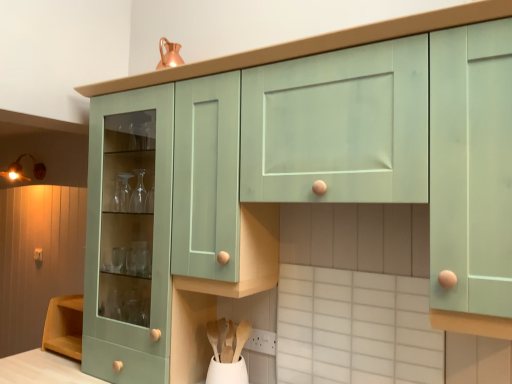
Question: From the image's perspective, is matte wooden knob at lower left over mint green cabinet at center?

Choices:
 (A) no
 (B) yes

Answer: (A)

Question: Can you confirm if matte wooden knob at lower left is thinner than mint green cabinet at center?

Choices:
 (A) yes
 (B) no

Answer: (A)

Question: Is matte wooden knob at lower left completely or partially outside of mint green cabinet at center?

Choices:
 (A) yes
 (B) no

Answer: (A)

Question: Would you say matte wooden knob at lower left contains mint green cabinet at center?

Choices:
 (A) yes
 (B) no

Answer: (B)

Question: Is matte wooden knob at lower left behind mint green cabinet at center?

Choices:
 (A) yes
 (B) no

Answer: (A)

Question: In the image, is white matte vase at lower center positioned in front of or behind wooden at lower center, which is the 1th spoon from right to left?

Choices:
 (A) behind
 (B) front

Answer: (B)

Question: Based on their positions, is white matte vase at lower center located to the left or right of wooden at lower center, positioned as the second spoon in left-to-right order?

Choices:
 (A) right
 (B) left

Answer: (B)

Question: From the image's perspective, is white matte vase at lower center positioned above or below wooden at lower center, positioned as the second spoon in left-to-right order?

Choices:
 (A) above
 (B) below

Answer: (B)

Question: Do you think white matte vase at lower center is within wooden at lower center, positioned as the second spoon in left-to-right order, or outside of it?

Choices:
 (A) outside
 (B) inside

Answer: (A)

Question: From the image's perspective, relative to white matte vase at lower center, is white plastic power plugs and sockets at lower center above or below?

Choices:
 (A) below
 (B) above

Answer: (B)

Question: Is white plastic power plugs and sockets at lower center inside or outside of white matte vase at lower center?

Choices:
 (A) inside
 (B) outside

Answer: (B)

Question: Looking at their shapes, would you say white plastic power plugs and sockets at lower center is wider or thinner than white matte vase at lower center?

Choices:
 (A) wide
 (B) thin

Answer: (B)

Question: Considering the positions of white plastic power plugs and sockets at lower center and white matte vase at lower center in the image, is white plastic power plugs and sockets at lower center bigger or smaller than white matte vase at lower center?

Choices:
 (A) big
 (B) small

Answer: (B)

Question: Does point (38, 253) appear closer or farther from the camera than point (32, 173)?

Choices:
 (A) closer
 (B) farther

Answer: (B)

Question: Is matte wooden knob at lower left wider or thinner than matte gold light fixture at upper left?

Choices:
 (A) wide
 (B) thin

Answer: (B)